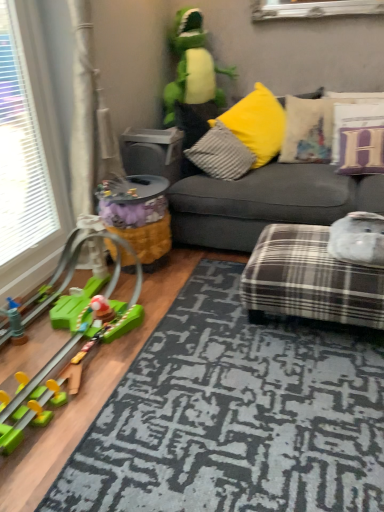
Locate an element on the screen. vacant area situated to the left side of yellow fabric toy at center, which is counted as the 2th toy, starting from the top is located at coordinates (83, 276).